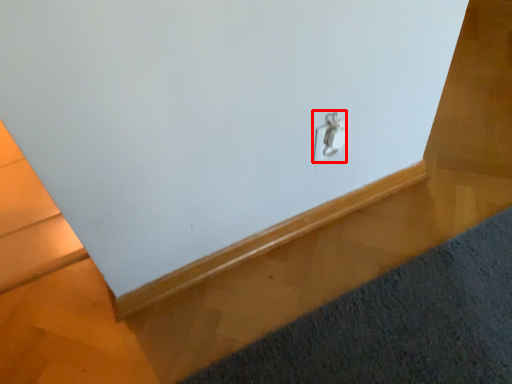
Question: From the image's perspective, where is lock (annotated by the red box) located in relation to mat in the image?

Choices:
 (A) below
 (B) above

Answer: (B)